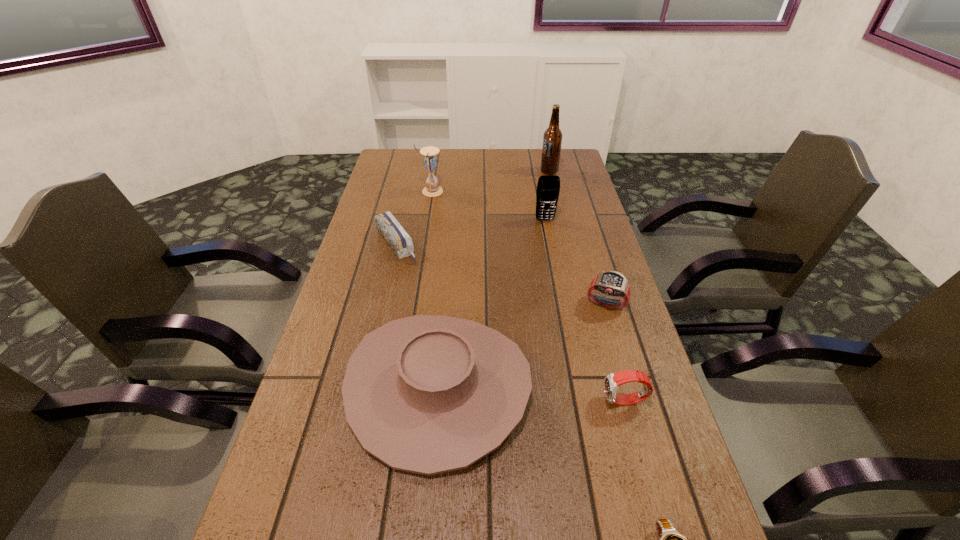
The image size is (960, 540). I want to click on the farthest object, so click(552, 139).

Identify the location of beer bottle. The height and width of the screenshot is (540, 960). (552, 139).

Locate an element on the screen. hourglass is located at coordinates (430, 161).

At what (x,y) coordinates should I click in order to perform the action: click on the third farthest object. Please return your answer as a coordinate pair (x, y). Looking at the image, I should click on (548, 188).

The image size is (960, 540). I want to click on cowboy hat, so point(427,394).

Identify the location of the second nearest watch. The width and height of the screenshot is (960, 540). (612, 381).

This screenshot has width=960, height=540. I want to click on the farthest watch, so click(x=612, y=283).

At what (x,y) coordinates should I click in order to perform the action: click on pencil box. Please return your answer as a coordinate pair (x, y). Image resolution: width=960 pixels, height=540 pixels. Looking at the image, I should click on (401, 243).

This screenshot has height=540, width=960. I want to click on the seventh tallest object, so click(401, 243).

Find the location of `vacant space positioned 0.230m on the label of the tallest object`. vacant space positioned 0.230m on the label of the tallest object is located at coordinates (479, 171).